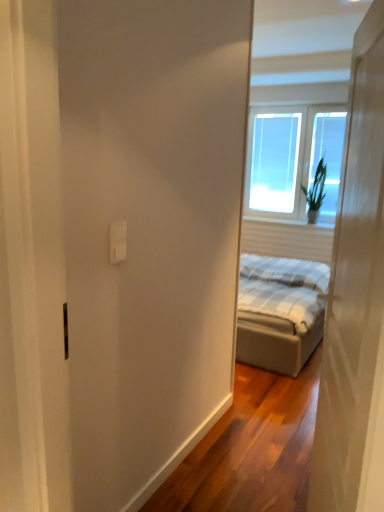
Question: Does green leafy plant at upper right turn towards transparent glass window at upper right?

Choices:
 (A) no
 (B) yes

Answer: (A)

Question: Can we say green leafy plant at upper right lies outside transparent glass window at upper right?

Choices:
 (A) yes
 (B) no

Answer: (A)

Question: Does green leafy plant at upper right have a lesser width compared to transparent glass window at upper right?

Choices:
 (A) no
 (B) yes

Answer: (A)

Question: From a real-world perspective, does green leafy plant at upper right stand above transparent glass window at upper right?

Choices:
 (A) no
 (B) yes

Answer: (A)

Question: Considering the relative sizes of green leafy plant at upper right and transparent glass window at upper right in the image provided, is green leafy plant at upper right shorter than transparent glass window at upper right?

Choices:
 (A) yes
 (B) no

Answer: (A)

Question: Can you confirm if green leafy plant at upper right is wider than transparent glass window at upper right?

Choices:
 (A) yes
 (B) no

Answer: (A)

Question: Considering the relative positions of green leafy plant at upper right and white plastic outlet at upper center in the image provided, is green leafy plant at upper right to the left of white plastic outlet at upper center from the viewer's perspective?

Choices:
 (A) no
 (B) yes

Answer: (A)

Question: Is green leafy plant at upper right positioned beyond the bounds of white plastic outlet at upper center?

Choices:
 (A) no
 (B) yes

Answer: (B)

Question: Does green leafy plant at upper right turn towards white plastic outlet at upper center?

Choices:
 (A) no
 (B) yes

Answer: (B)

Question: Can you confirm if green leafy plant at upper right is shorter than white plastic outlet at upper center?

Choices:
 (A) no
 (B) yes

Answer: (A)

Question: Is green leafy plant at upper right next to white plastic outlet at upper center?

Choices:
 (A) yes
 (B) no

Answer: (B)

Question: Is white plastic outlet at upper center completely or partially inside green leafy plant at upper right?

Choices:
 (A) yes
 (B) no

Answer: (B)

Question: Considering the relative positions of transparent glass window at upper right and white plastic outlet at upper center in the image provided, is transparent glass window at upper right to the right of white plastic outlet at upper center from the viewer's perspective?

Choices:
 (A) yes
 (B) no

Answer: (A)